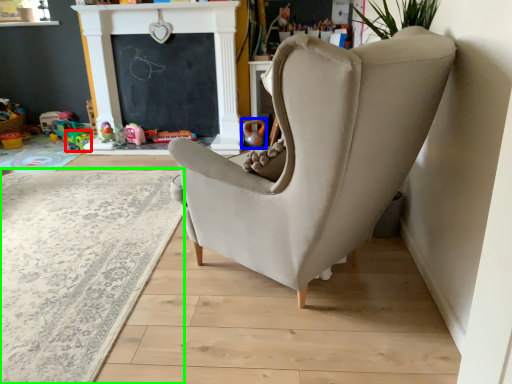
Question: Which object is positioned farthest from toy (highlighted by a red box)? Select from toy (highlighted by a blue box) and plain (highlighted by a green box).

Choices:
 (A) toy
 (B) plain

Answer: (B)